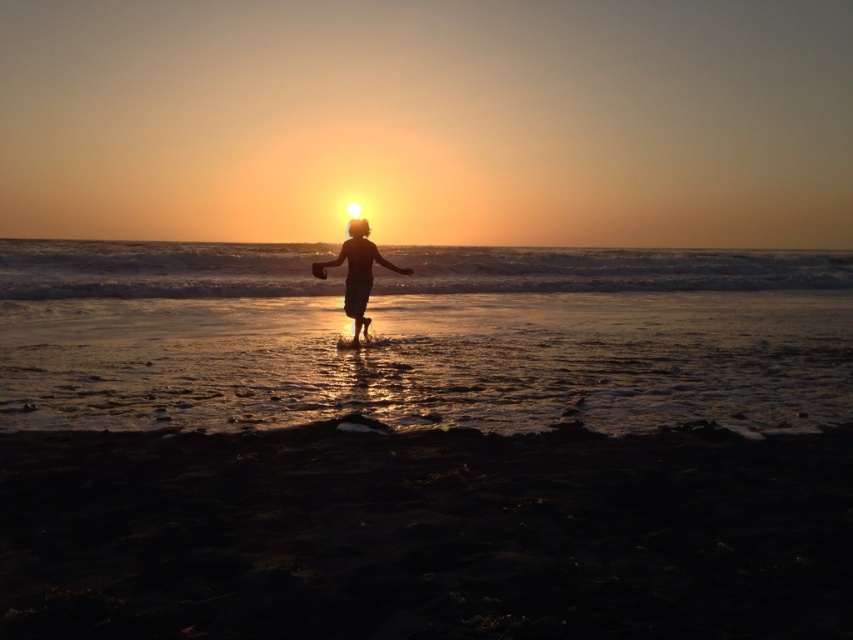
Does dark sand at lower center appear on the left side of shiny wet sand at center?

Incorrect, dark sand at lower center is not on the left side of shiny wet sand at center.

Which of these two, dark sand at lower center or shiny wet sand at center, stands taller?

Standing taller between the two is shiny wet sand at center.

Does point (567, 637) lie behind point (689, 401)?

No, it is not.

You are a GUI agent. You are given a task and a screenshot of the screen. Output one action in this format:
    pyautogui.click(x=<x>, y=<y>)
    Task: Click on the dark sand at lower center
    This screenshot has width=853, height=640.
    Given the screenshot: What is the action you would take?
    pyautogui.click(x=425, y=536)

Does dark sand at lower center have a larger size compared to silhouette wooden stick at center?

Actually, dark sand at lower center might be smaller than silhouette wooden stick at center.

Based on the photo, can you confirm if dark sand at lower center is shorter than silhouette wooden stick at center?

Yes, dark sand at lower center is shorter than silhouette wooden stick at center.

Describe the element at coordinates (425, 536) in the screenshot. I see `dark sand at lower center` at that location.

Identify the location of dark sand at lower center. (425, 536).

Does shiny wet sand at center come behind silhouette wooden stick at center?

No, shiny wet sand at center is closer to the viewer.

Does shiny wet sand at center appear under silhouette wooden stick at center?

No, shiny wet sand at center is not below silhouette wooden stick at center.

Which is behind, point (581, 337) or point (358, 243)?

The point (581, 337) is behind.

Locate an element on the screen. The image size is (853, 640). shiny wet sand at center is located at coordinates (422, 337).